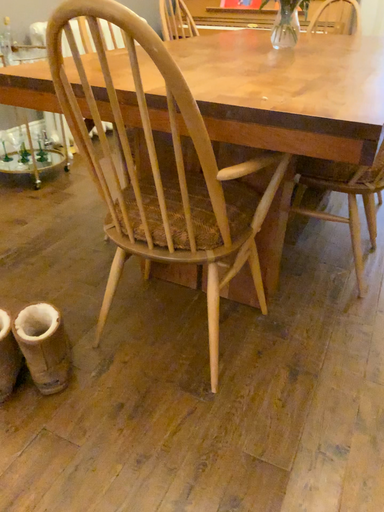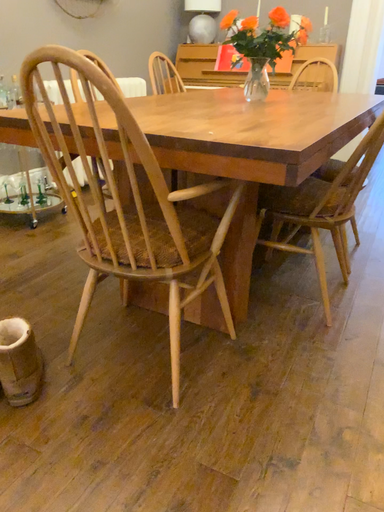
Question: Which way did the camera rotate in the video?

Choices:
 (A) rotated downward
 (B) rotated upward

Answer: (B)